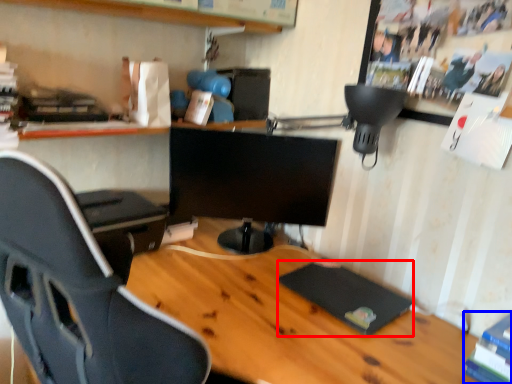
Question: Which object is closer to the camera taking this photo, pad (highlighted by a red box) or book (highlighted by a blue box)?

Choices:
 (A) pad
 (B) book

Answer: (B)